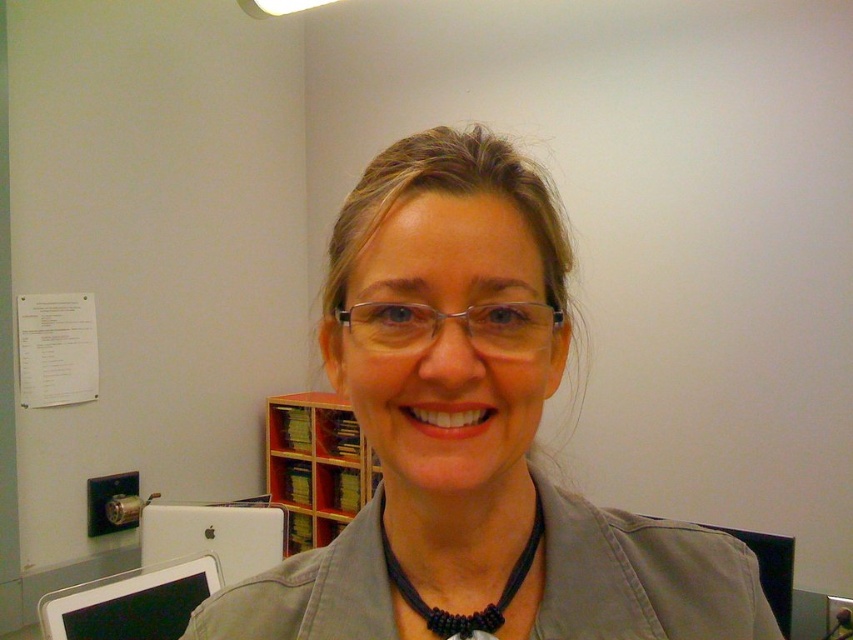
Question: Estimate the real-world distances between objects in this image. Which object is closer to the wooden bookshelf at center?

Choices:
 (A) black beaded necklace at center
 (B) matte gray jacket at center
 (C) black glossy tablet at lower left

Answer: (C)

Question: Can you confirm if wooden bookshelf at center is positioned to the right of black glossy tablet at lower left?

Choices:
 (A) yes
 (B) no

Answer: (A)

Question: Is black glossy tablet at lower left behind black beaded necklace at center?

Choices:
 (A) no
 (B) yes

Answer: (B)

Question: Is black glossy tablet at lower left to the right of black beaded necklace at center from the viewer's perspective?

Choices:
 (A) yes
 (B) no

Answer: (B)

Question: Which object appears closest to the camera in this image?

Choices:
 (A) wooden bookshelf at center
 (B) black glossy tablet at lower left

Answer: (B)

Question: Among these points, which one is nearest to the camera?

Choices:
 (A) (412, 598)
 (B) (51, 595)
 (C) (347, 445)
 (D) (680, 596)

Answer: (A)